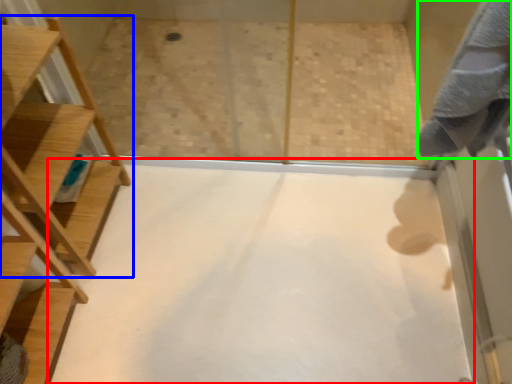
Question: Which is nearer to the plain (highlighted by a red box)? furniture (highlighted by a blue box) or bath towel (highlighted by a green box).

Choices:
 (A) furniture
 (B) bath towel

Answer: (A)